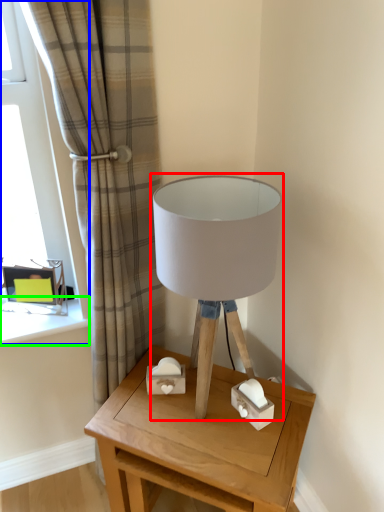
Question: Estimate the real-world distances between objects in this image. Which object is closer to lamp (highlighted by a red box), window (highlighted by a blue box) or window sill (highlighted by a green box)?

Choices:
 (A) window
 (B) window sill

Answer: (A)